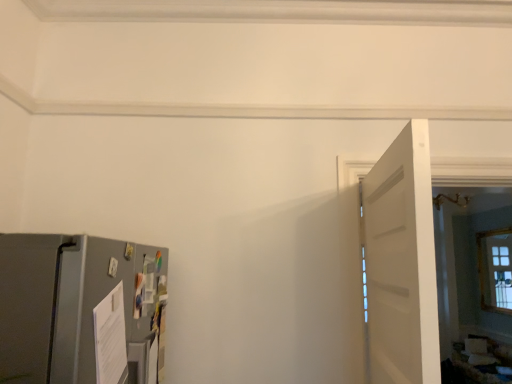
Question: Relative to satin gray refrigerator at lower left, is white matte door at right in front or behind?

Choices:
 (A) behind
 (B) front

Answer: (A)

Question: From the image's perspective, is white matte door at right above or below satin gray refrigerator at lower left?

Choices:
 (A) below
 (B) above

Answer: (B)

Question: Does point (368, 251) appear closer or farther from the camera than point (93, 339)?

Choices:
 (A) closer
 (B) farther

Answer: (B)

Question: Is satin gray refrigerator at lower left to the left or to the right of white matte door at right in the image?

Choices:
 (A) right
 (B) left

Answer: (B)

Question: Considering the positions of satin gray refrigerator at lower left and white matte door at right in the image, is satin gray refrigerator at lower left bigger or smaller than white matte door at right?

Choices:
 (A) small
 (B) big

Answer: (B)

Question: Is satin gray refrigerator at lower left in front of or behind white matte door at right in the image?

Choices:
 (A) behind
 (B) front

Answer: (B)

Question: From a real-world perspective, is satin gray refrigerator at lower left physically located above or below white matte door at right?

Choices:
 (A) below
 (B) above

Answer: (A)